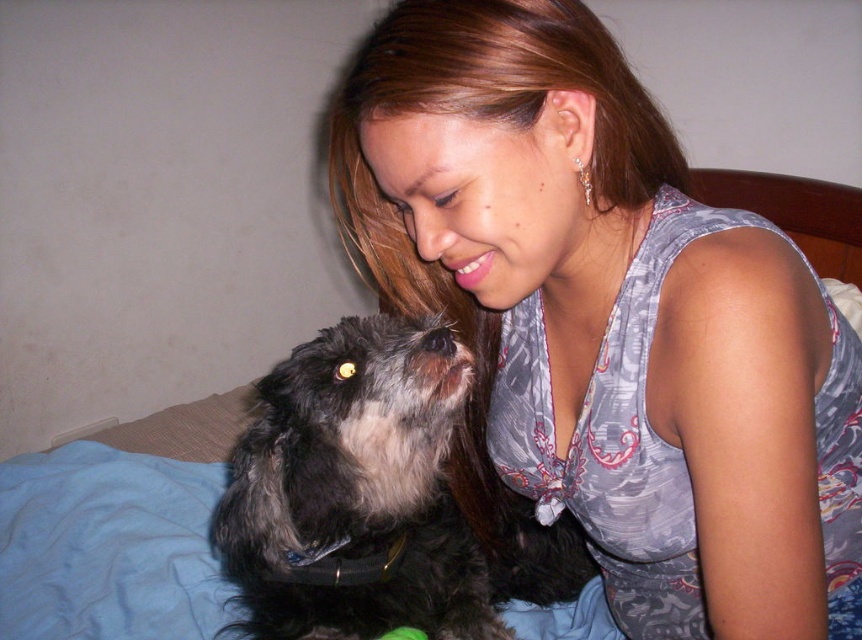
Can you confirm if gray fabric at upper center is smaller than fuzzy black dog at center?

Yes.

Is the position of gray fabric at upper center more distant than that of fuzzy black dog at center?

No, it is not.

Find the location of a particular element. The image size is (862, 640). gray fabric at upper center is located at coordinates (608, 317).